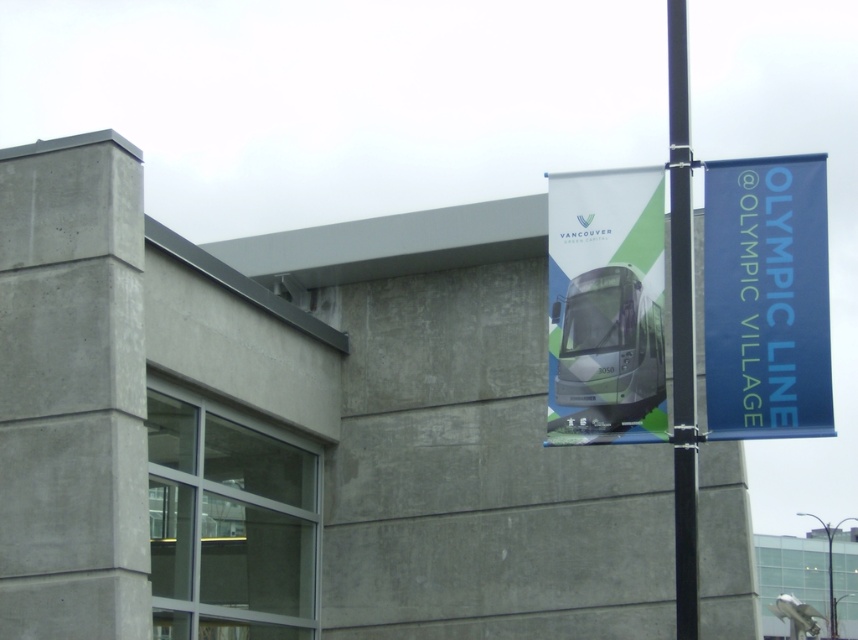
Question: Does blue fabric banner at upper right have a smaller size compared to black metal pole at right?

Choices:
 (A) yes
 (B) no

Answer: (A)

Question: Can you confirm if blue fabric banner at upper right is bigger than black metal pole at right?

Choices:
 (A) no
 (B) yes

Answer: (A)

Question: Which object is positioned closest to the green matte bus at center?

Choices:
 (A) blue fabric banner at upper right
 (B) black metal pole at right

Answer: (B)

Question: Which point is farther from the camera taking this photo?

Choices:
 (A) (770, 204)
 (B) (624, 403)
 (C) (690, 227)

Answer: (A)

Question: Which point appears farthest from the camera in this image?

Choices:
 (A) (677, 616)
 (B) (741, 228)
 (C) (647, 307)

Answer: (A)

Question: Does blue fabric banner at upper right appear under green matte bus at center?

Choices:
 (A) no
 (B) yes

Answer: (A)